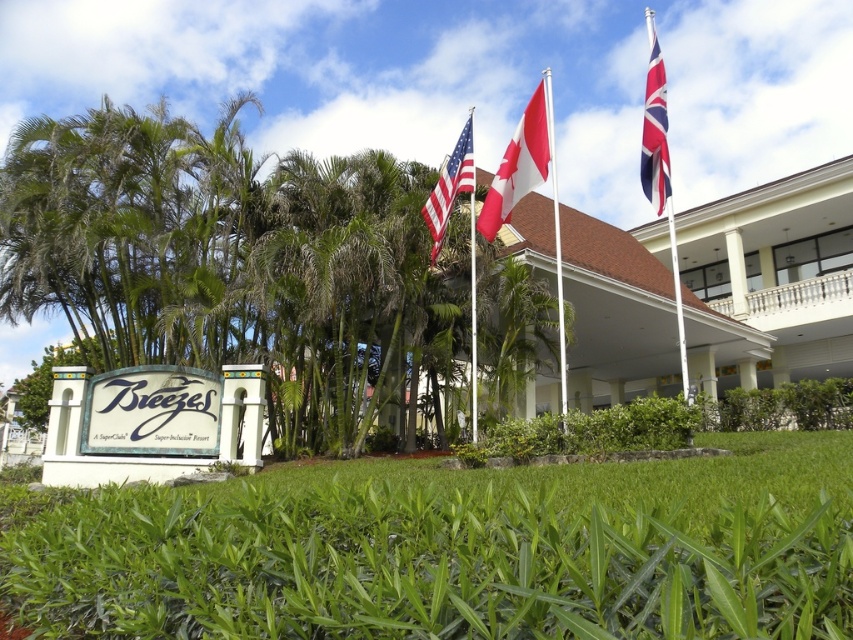
You are a guest at the Breezes resort and want to take a photo with both the red and white striped flag at upper right and the american flag at upper center in the background. Since you want both flags to be clearly visible in your photo, which flag should you position closer to the camera to ensure it doesn not appear too small?

To ensure both flags are clearly visible, you should position the american flag at upper center closer to the camera because it is smaller in size than the red and white striped flag at upper right. This way, the smaller flag will appear larger in the photo, balancing their visibility.